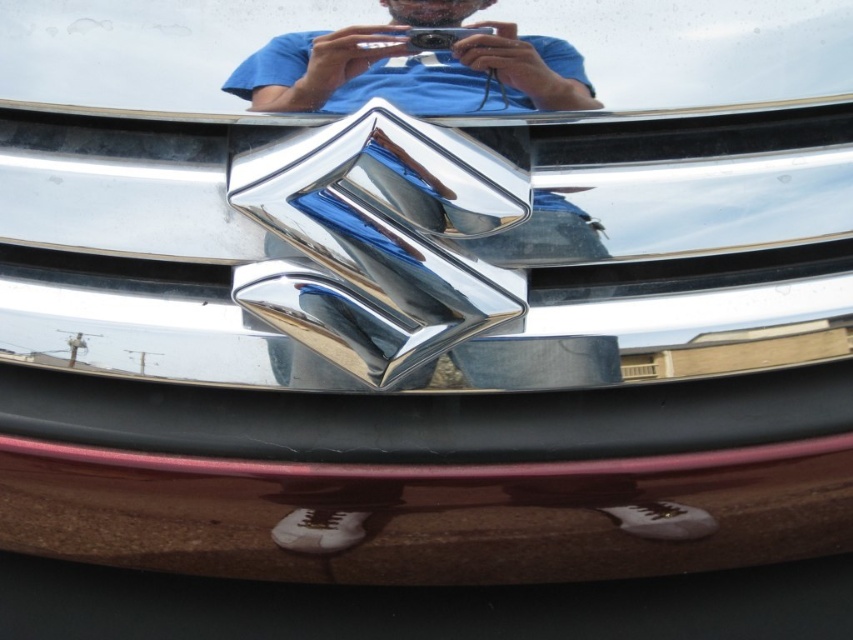
Between glossy black bumper at lower center and chrome metallic logo at center, which one appears on the right side from the viewer's perspective?

chrome metallic logo at center is more to the right.

Who is more distant from viewer, (782, 515) or (566, 83)?

The point (782, 515) is more distant.

I want to click on glossy black bumper at lower center, so click(x=430, y=513).